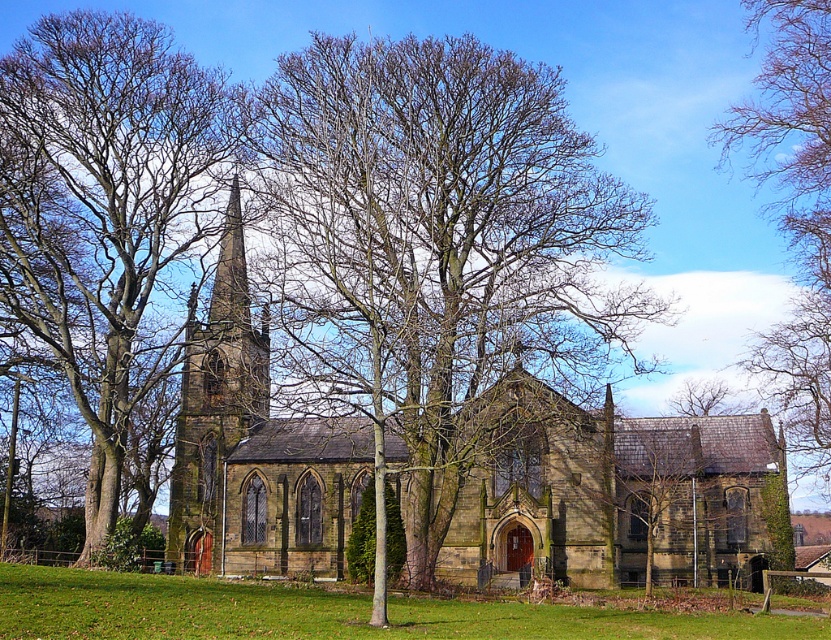
You are standing in front of the church and want to take a photo of the brown bark tree at left. Where should you position yourself to capture it in the frame?

To capture the brown bark tree at left in your photo, position yourself so that the tree is centered at coordinates approximately 0.328 along the horizontal axis and 0.128 along the vertical axis of the frame.

You are standing in front of the church and want to take a photo of both the bare branches at center and the brown stone tower at center. Which object will appear larger in your photo?

The bare branches at center will appear larger in the photo because they are closer to the viewer than the brown stone tower at center.

You are a bird flying over the church and want to land on the highest point between the bare branches at upper right and the brown stone tower at center. Which one should you choose?

The bare branches at upper right is taller than the brown stone tower at center, so you should choose the bare branches at upper right to land on the highest point.